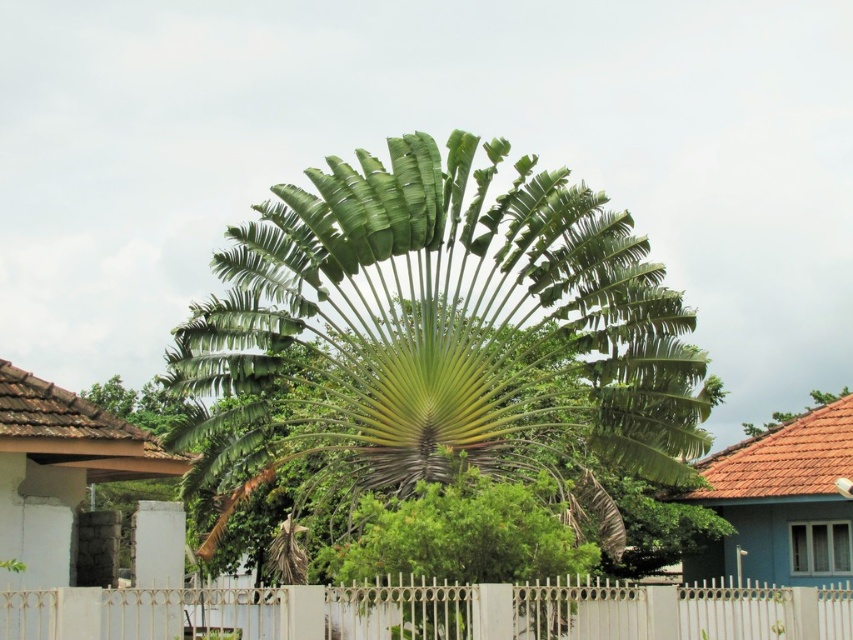
You are standing in a tropical garden and see the green leafy palm at center. If you want to take a photo of it from a distance of 50 meters, will you need to move closer or farther away?

The green leafy palm at center is currently 47.07 meters away. To achieve a distance of 50 meters, you need to move farther away from the palm.

You are a gardener standing in front of the white metal fence at center. You want to trim the green leafy palm at center. Can you reach the palm leaves without climbing over the fence?

The green leafy palm at center is located above the white metal fence at center, so you can reach the palm leaves without climbing over the fence since they are already above the fence level.

You are standing in a tropical garden and want to walk towards the green leafy palm at center and the white metal fence at center. Which object will you encounter first?

You will encounter the green leafy palm at center first because it is closer to you than the white metal fence at center, which is further away.